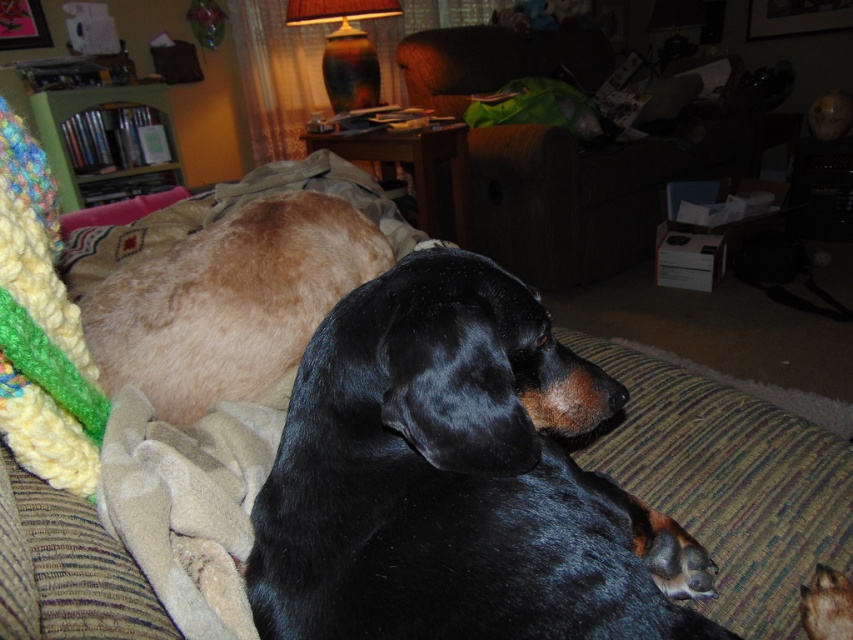
You are trying to decide whether to place a new rectangular coffee table between the brown wood armchair at center and the golden fur dachshund at left. The table is 1.2 meters wide. Can the table fit between them without moving either object?

The brown wood armchair at center might be wider than golden fur dachshund at left, so the table may not fit between them if the space between is narrower than 1.2 meters. However, since the exact distance isn

You are a small child trying to reach a toy placed on the brown wood armchair at center. The black smooth dog at center is in your way. Can you walk around the dog to reach the chair?

The black smooth dog at center is shorter than the brown wood armchair at center, so you can walk around it since it is lower in height.